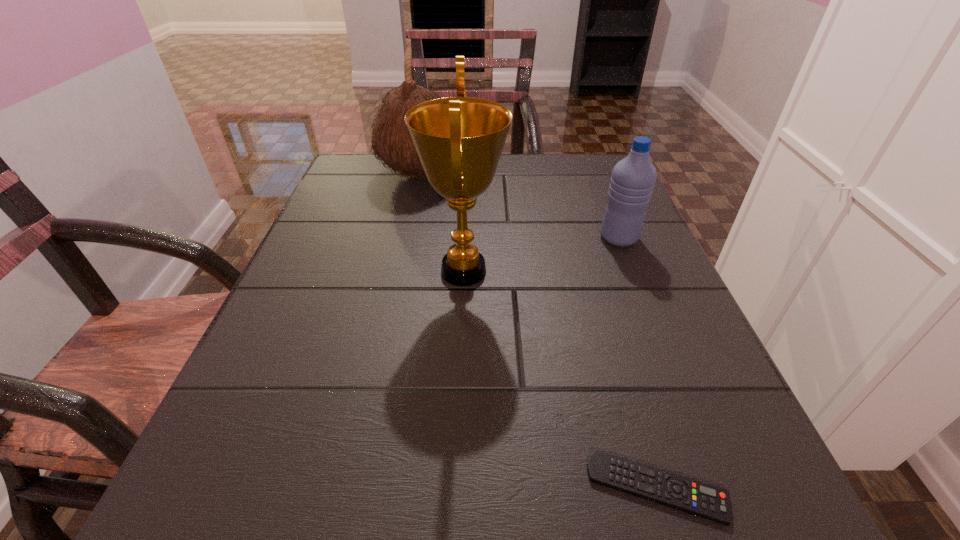
Where is `vacant area in the image that satisfies the following two spatial constraints: 1. on the back side of the remote control; 2. on the front view with handles of the award`? This screenshot has width=960, height=540. vacant area in the image that satisfies the following two spatial constraints: 1. on the back side of the remote control; 2. on the front view with handles of the award is located at coordinates (592, 271).

Where is `vacant region that satisfies the following two spatial constraints: 1. on the front view with handles of the remote control; 2. on the right side of the award`? The image size is (960, 540). vacant region that satisfies the following two spatial constraints: 1. on the front view with handles of the remote control; 2. on the right side of the award is located at coordinates (454, 488).

Where is `free space that satisfies the following two spatial constraints: 1. on the surface of the nearest object; 2. on the right side of the second tallest object`? The image size is (960, 540). free space that satisfies the following two spatial constraints: 1. on the surface of the nearest object; 2. on the right side of the second tallest object is located at coordinates pyautogui.click(x=349, y=488).

At what (x,y) coordinates should I click in order to perform the action: click on vacant region that satisfies the following two spatial constraints: 1. on the surface of the third shortest object; 2. on the right side of the shortest object. Please return your answer as a coordinate pair (x, y). Looking at the image, I should click on (349, 488).

You are a GUI agent. You are given a task and a screenshot of the screen. Output one action in this format:
    pyautogui.click(x=<x>, y=<y>)
    Task: Click on the vacant region that satisfies the following two spatial constraints: 1. on the surface of the second shortest object; 2. on the right side of the third shortest object
    This screenshot has height=540, width=960.
    Given the screenshot: What is the action you would take?
    pyautogui.click(x=404, y=238)

At what (x,y) coordinates should I click in order to perform the action: click on free region that satisfies the following two spatial constraints: 1. on the surface of the coconut; 2. on the back side of the nearest object. Please return your answer as a coordinate pair (x, y). Looking at the image, I should click on (349, 488).

Image resolution: width=960 pixels, height=540 pixels. In order to click on vacant area that satisfies the following two spatial constraints: 1. on the surface of the remote control; 2. on the right side of the coconut in this screenshot , I will do `click(349, 488)`.